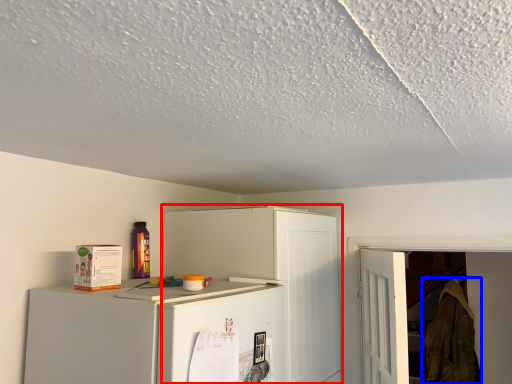
Question: Which of the following is the farthest to the observer, cabinetry (highlighted by a red box) or laundry (highlighted by a blue box)?

Choices:
 (A) cabinetry
 (B) laundry

Answer: (B)